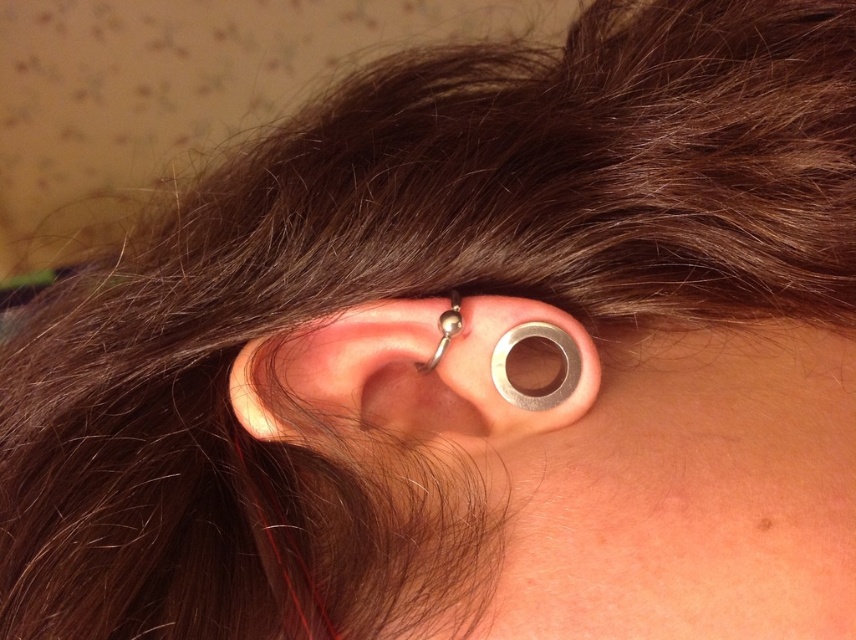
Is silver metallic ring at center bigger than polished silver ball at center?

Indeed, silver metallic ring at center has a larger size compared to polished silver ball at center.

I want to click on silver metallic ring at center, so 417,372.

Describe the element at coordinates (417, 372) in the screenshot. I see `silver metallic ring at center` at that location.

Image resolution: width=856 pixels, height=640 pixels. Find the location of `silver metallic ring at center`. silver metallic ring at center is located at coordinates (417, 372).